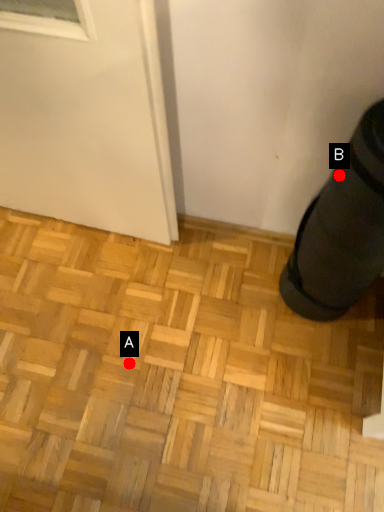
Question: Two points are circled on the image, labeled by A and B beside each circle. Which point appears closest to the camera in this image?

Choices:
 (A) A is closer
 (B) B is closer

Answer: (B)